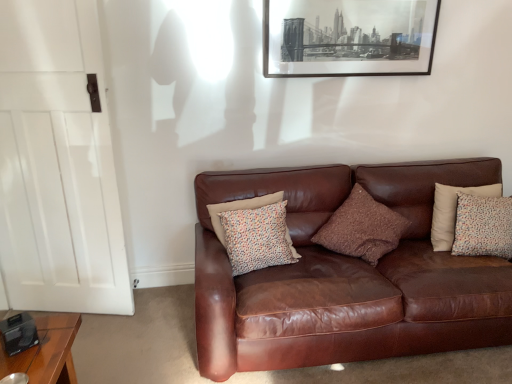
Question: Considering the positions of point (348, 8) and point (368, 327), is point (348, 8) closer or farther from the camera than point (368, 327)?

Choices:
 (A) closer
 (B) farther

Answer: (B)

Question: Is black matte picture frame at upper center wider or thinner than brown leather couch at center?

Choices:
 (A) thin
 (B) wide

Answer: (A)

Question: Which of these objects is positioned closest to the patterned fabric pillow at right, which appears as the third pillow when viewed from the left?

Choices:
 (A) black matte picture frame at upper center
 (B) brown wooden table at lower left
 (C) white wood door at left
 (D) brown leather couch at center
 (E) brown textured pillow at center, the second pillow positioned from the right

Answer: (E)

Question: Based on their relative distances, which object is nearer to the brown textured pillow at center, acting as the second pillow starting from the left?

Choices:
 (A) patterned fabric pillow at right, which appears as the third pillow when viewed from the left
 (B) brown leather couch at center
 (C) multicolored fabric pillow at center, positioned as the 3th pillow in right-to-left order
 (D) white wood door at left
 (E) black matte picture frame at upper center

Answer: (B)